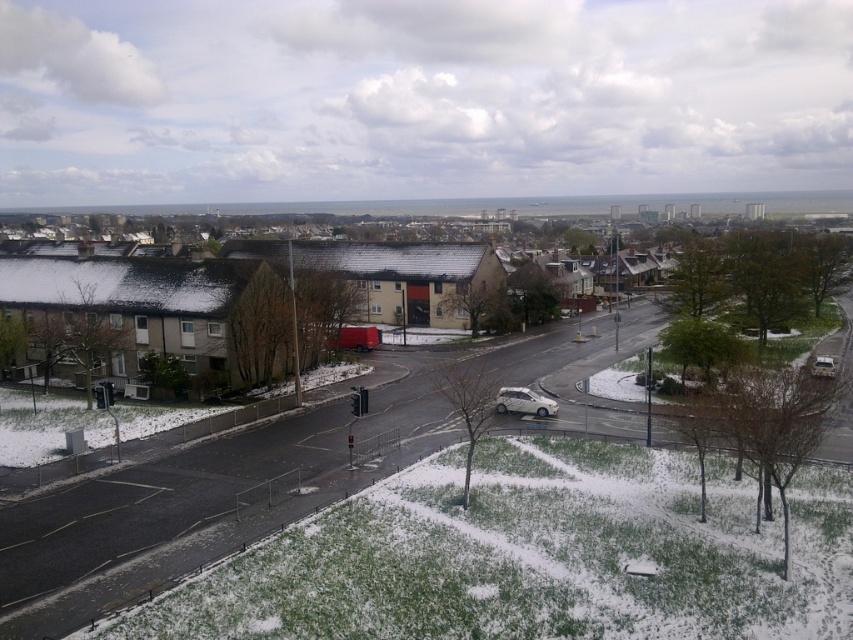
The height and width of the screenshot is (640, 853). In order to click on matte red truck at center in this screenshot , I will do pyautogui.click(x=184, y=488).

Is matte red truck at center thinner than white matte car at center?

No, matte red truck at center is not thinner than white matte car at center.

I want to click on matte red truck at center, so click(184, 488).